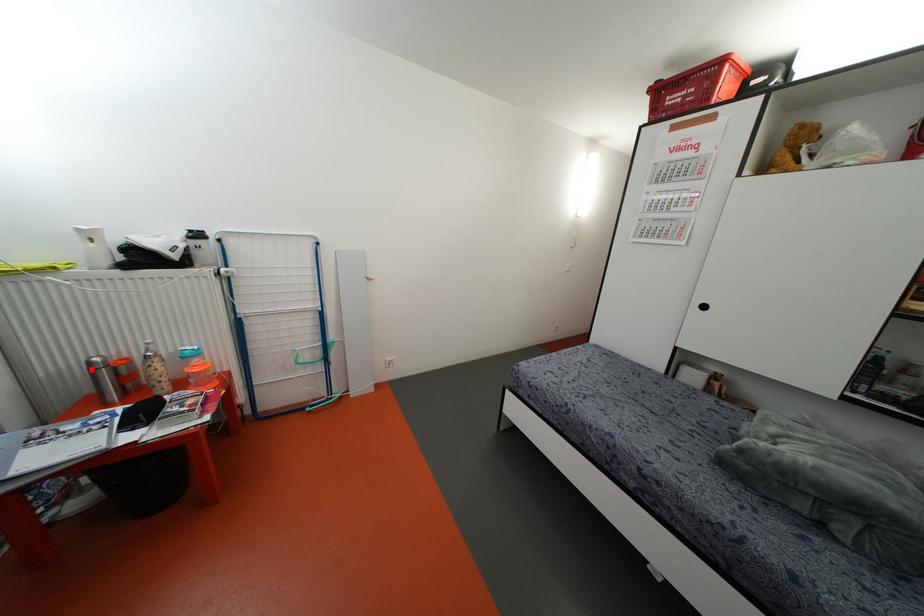
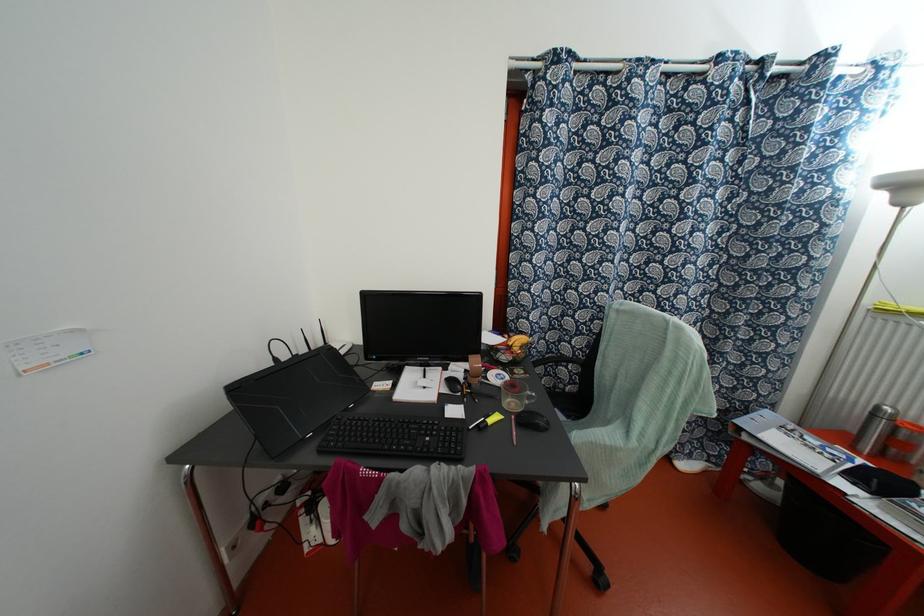
Find the pixel in the second image that matches the highlighted location in the first image.

(872, 415)